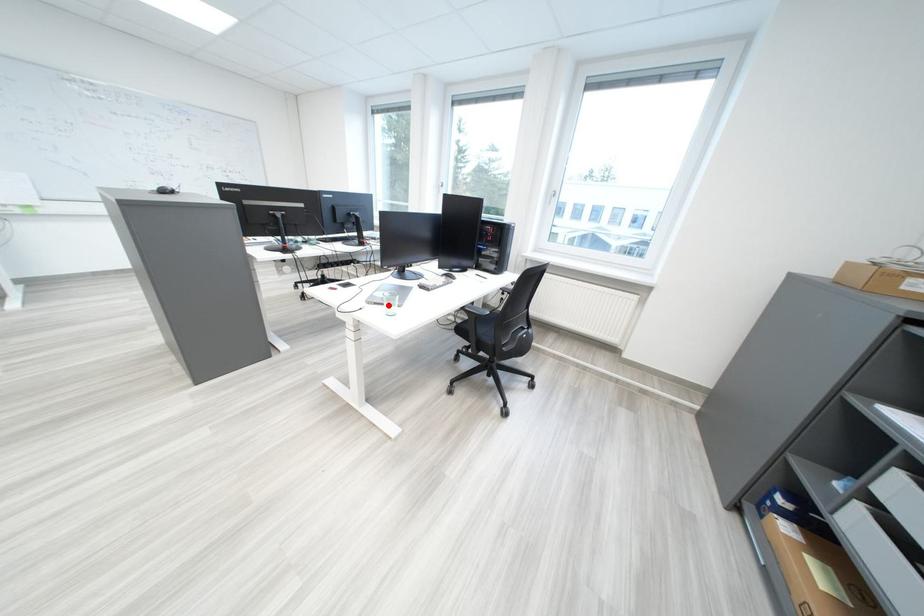
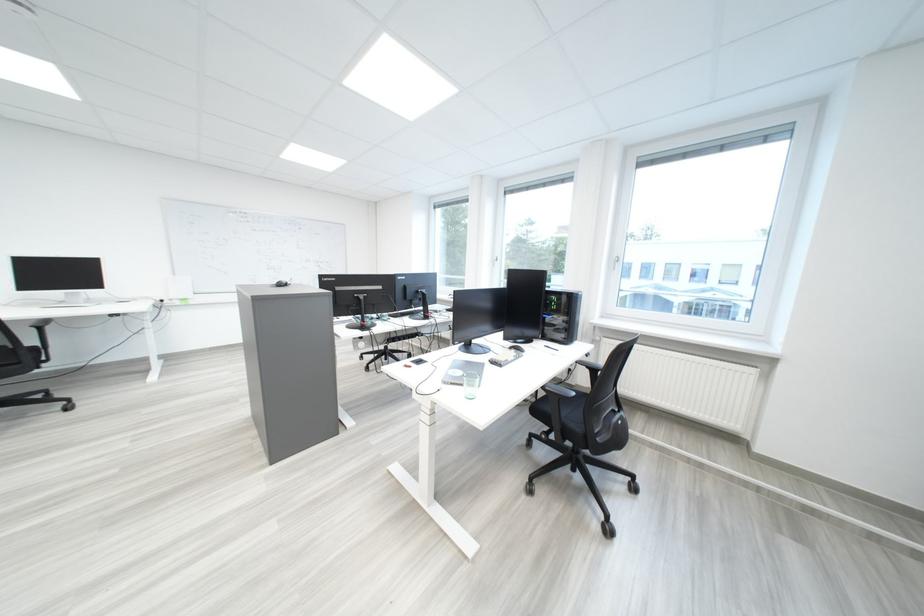
Find the pixel in the second image that matches the highlighted location in the first image.

(465, 386)